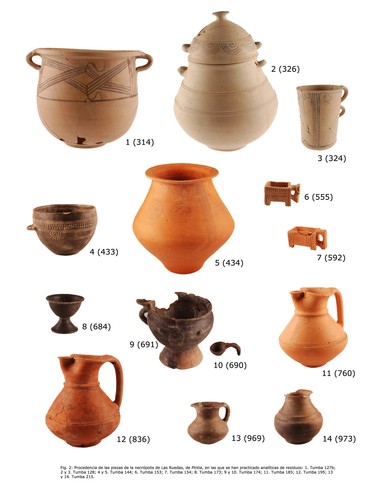
At what (x,y) coordinates should I click in order to perform the action: click on orange pitcher. Please return your answer as a coordinate pair (x, y). Looking at the image, I should click on pyautogui.click(x=316, y=331).